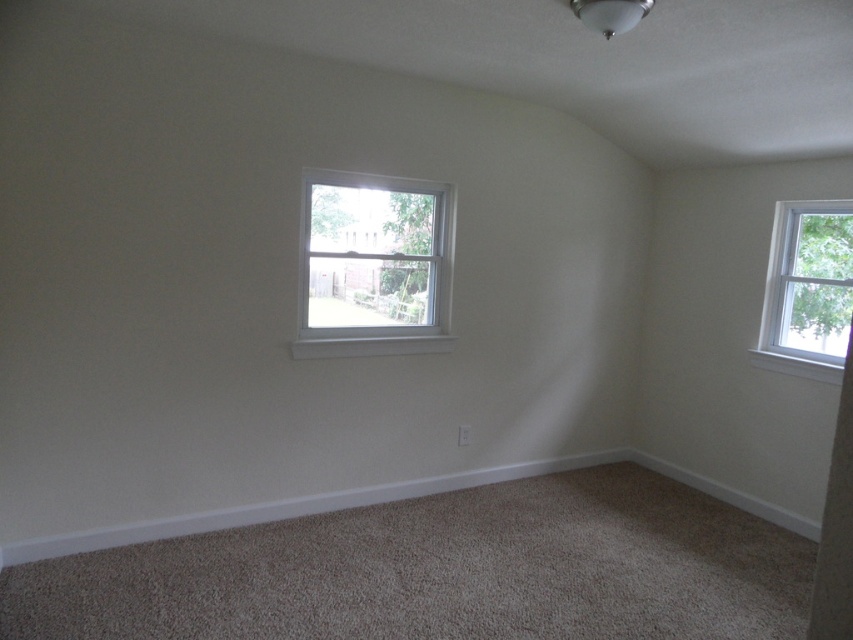
Can you confirm if white painted wood window at center is thinner than white wood window at upper right?

In fact, white painted wood window at center might be wider than white wood window at upper right.

Which is behind, point (381, 288) or point (802, 259)?

The point (802, 259) is more distant.

Measure the distance between point [303,196] and camera.

11.12 feet

Image resolution: width=853 pixels, height=640 pixels. Identify the location of white painted wood window at center. (373, 264).